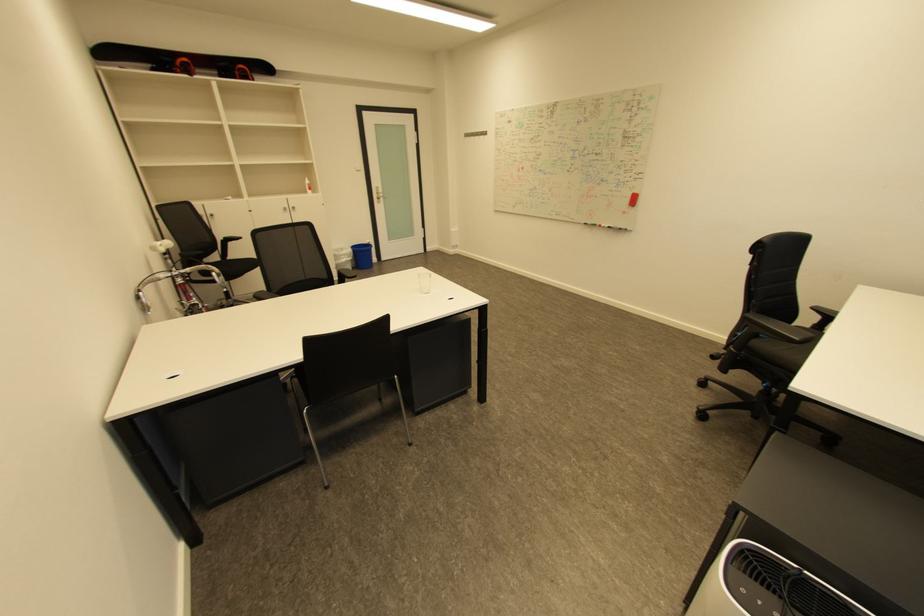
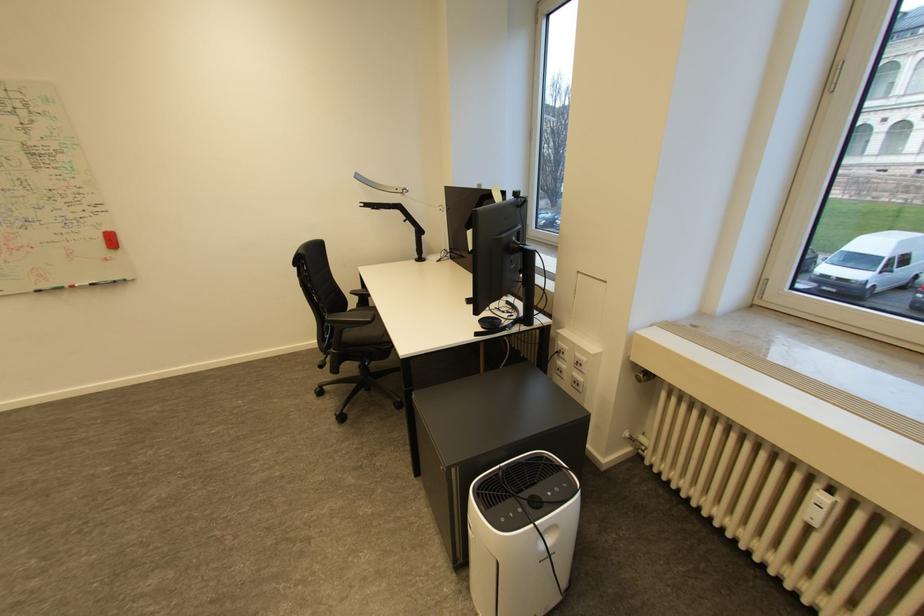
Question: The camera is either moving clockwise (left) or counter-clockwise (right) around the object. The first image is from the beginning of the video and the second image is from the end. Is the camera moving left or right when shooting the video?

Choices:
 (A) Left
 (B) Right

Answer: (A)